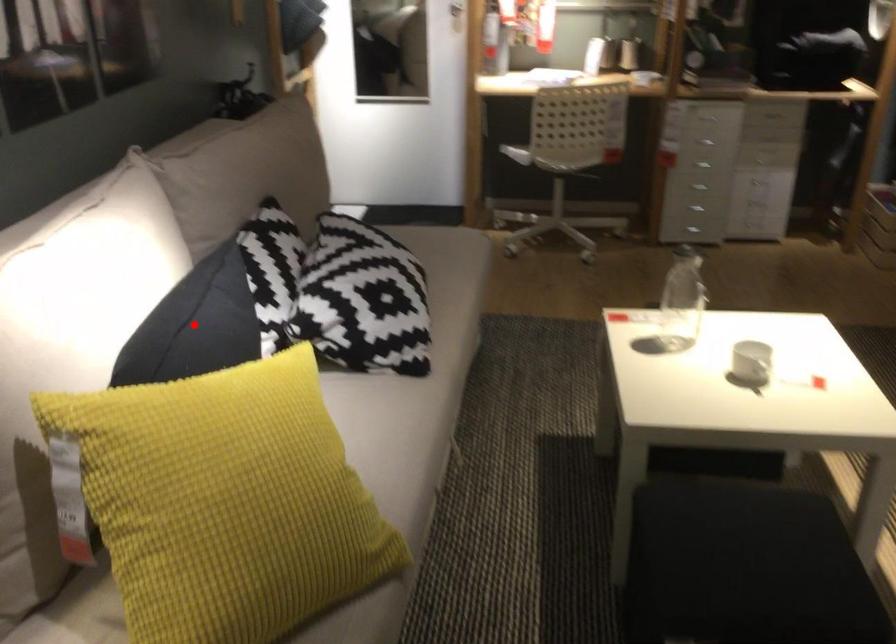
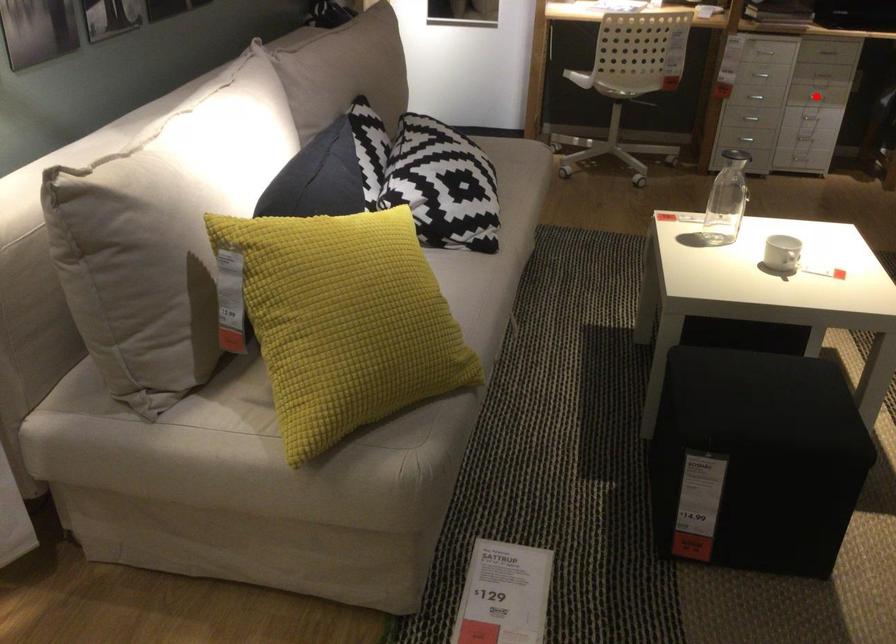
I am providing you with two images of the same scene from different viewpoints. A red point is marked on the first image and another point is marked on the second image. Are the points marked in image1 and image2 representing the same 3D position?

No